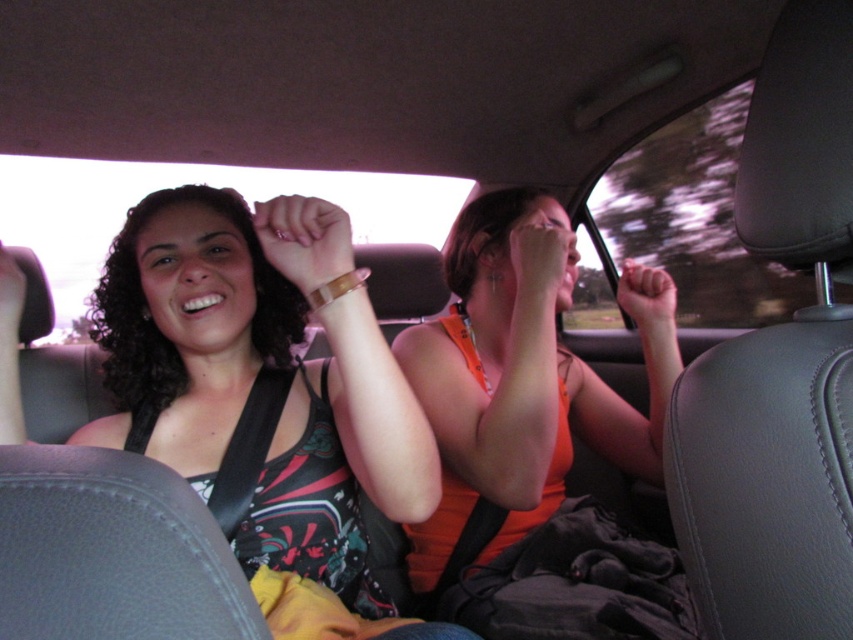
You are a photographer taking a picture of the orange fabric tank top at center and the matte orange hand at center. Which object will appear larger in your photo?

The orange fabric tank top at center is closer to the viewer than the matte orange hand at center, so it will appear larger in the photo.

You are a delivery robot trying to place a small package between the matte brown bracelet at center and the matte black hand at upper left. The package is 30 inches long. Can you fit it in the space between them?

The space between the matte brown bracelet at center and the matte black hand at upper left is only 27.90 inches, which is shorter than the 30 inch package. The package cannot fit in that space.